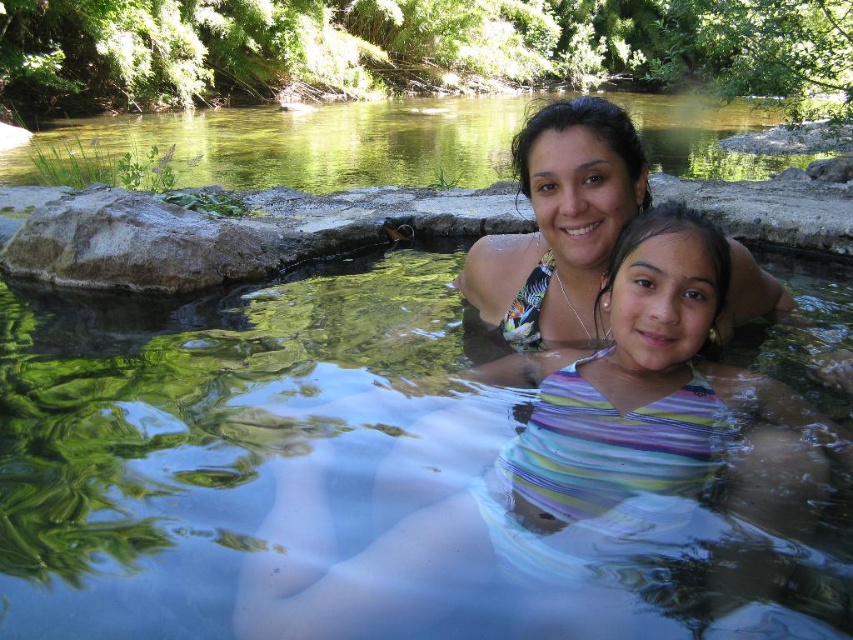
Question: Can you confirm if clear water at upper center is positioned above multicolored bikini top at center?

Choices:
 (A) no
 (B) yes

Answer: (B)

Question: Among these points, which one is nearest to the camera?

Choices:
 (A) (277, 144)
 (B) (508, 529)

Answer: (B)

Question: Observing the image, what is the correct spatial positioning of striped fabric swimsuit at center in reference to clear water at upper center?

Choices:
 (A) above
 (B) below

Answer: (B)

Question: In this image, where is striped fabric swimsuit at center located relative to multicolored bikini top at center?

Choices:
 (A) left
 (B) right

Answer: (A)

Question: Which point is farther from the camera taking this photo?

Choices:
 (A) (633, 330)
 (B) (734, 125)

Answer: (B)

Question: Estimate the real-world distances between objects in this image. Which object is closer to the striped fabric swimsuit at center?

Choices:
 (A) clear water at upper center
 (B) multicolored bikini top at center

Answer: (B)